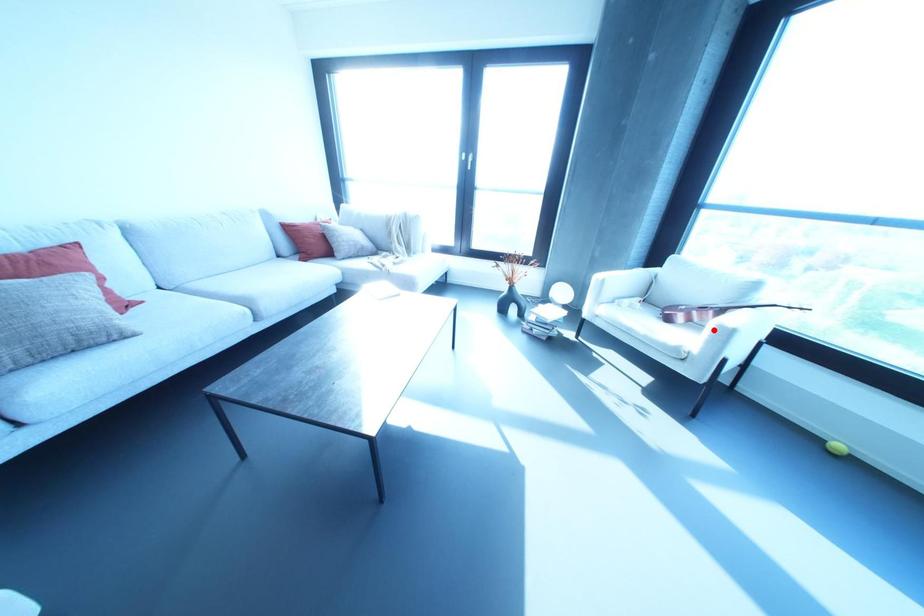
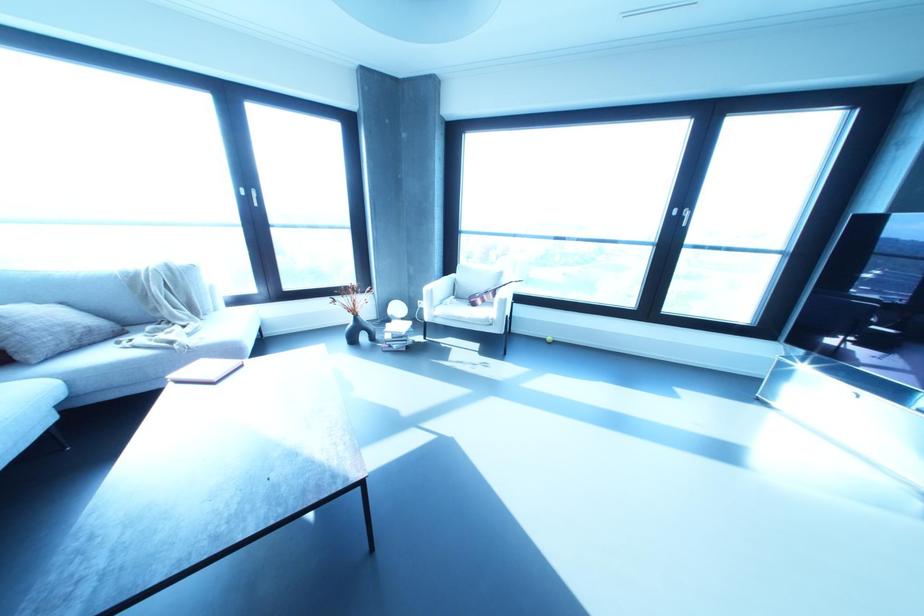
In the second image, find the point that corresponds to the highlighted location in the first image.

(497, 302)